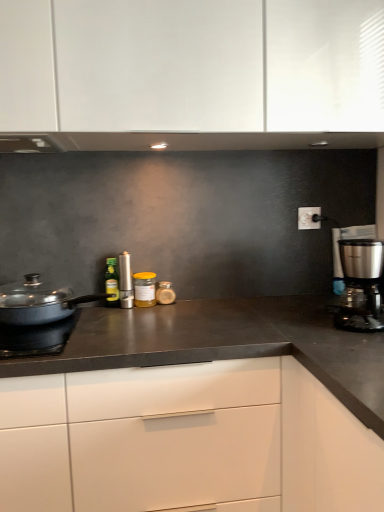
This screenshot has height=512, width=384. Identify the location of free point above white matte cabinet at center (from a real-world perspective). (196, 316).